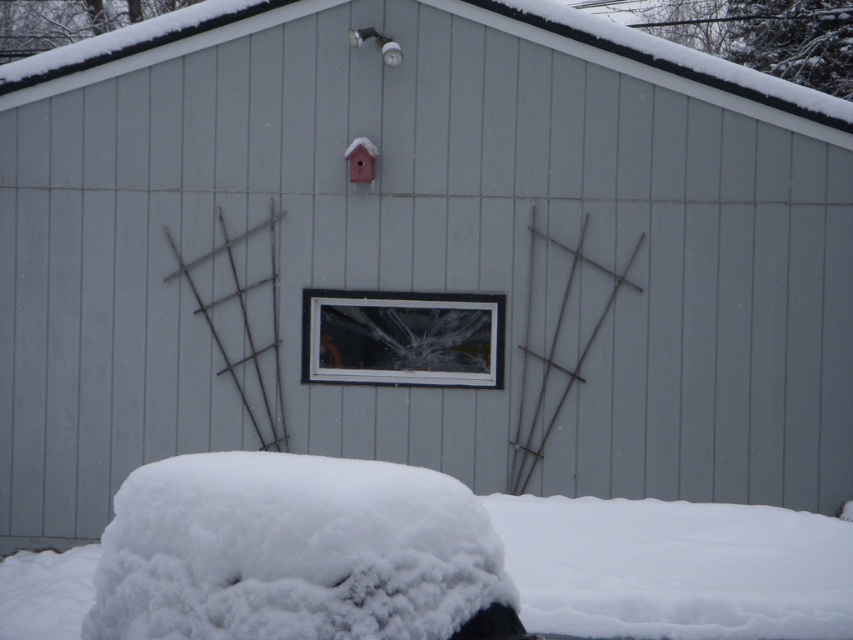
Can you confirm if white fluffy snow at lower center is positioned above clear glass window at center?

Incorrect, white fluffy snow at lower center is not positioned above clear glass window at center.

Does white fluffy snow at lower center lie in front of clear glass window at center?

Yes.

What do you see at coordinates (462, 570) in the screenshot?
I see `white fluffy snow at lower center` at bounding box center [462, 570].

Where is `white fluffy snow at lower center`? The height and width of the screenshot is (640, 853). white fluffy snow at lower center is located at coordinates (462, 570).